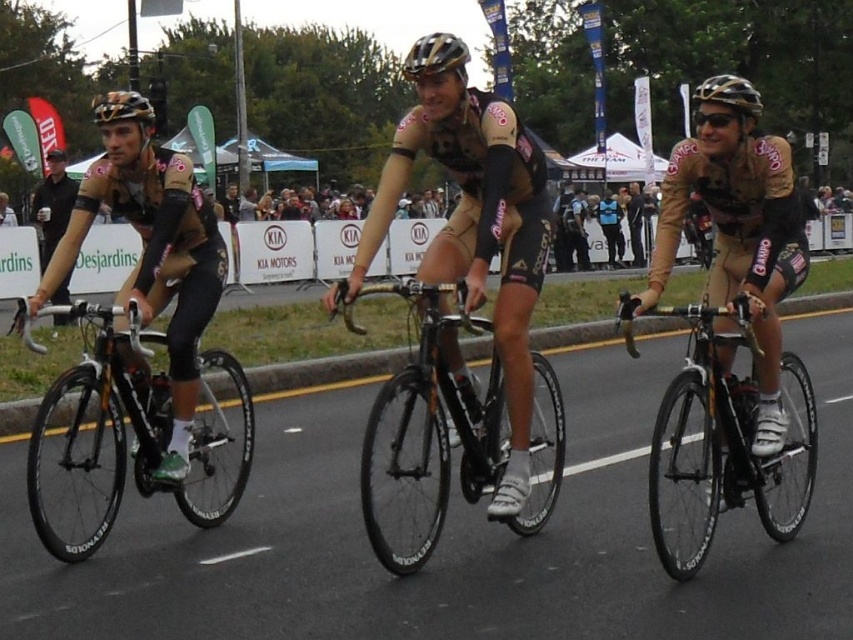
Question: In this image, where is shiny black frame at left located relative to gold metallic helmet at upper left?

Choices:
 (A) right
 (B) left

Answer: (A)

Question: Which point is farther from the camera taking this photo?

Choices:
 (A) (123, 96)
 (B) (438, 477)

Answer: (B)

Question: Can you confirm if matte black helmet at left is smaller than gold metallic bicycle helmet at center?

Choices:
 (A) no
 (B) yes

Answer: (A)

Question: Which point is closer to the camera taking this photo?

Choices:
 (A) (733, 81)
 (B) (537, 410)
 (C) (724, 141)
 (D) (138, 97)

Answer: (A)

Question: Observing the image, what is the correct spatial positioning of shiny black frame at left in reference to gold metallic helmet at center?

Choices:
 (A) above
 (B) below

Answer: (B)

Question: Which point is farther to the camera?

Choices:
 (A) (212, 456)
 (B) (466, 48)

Answer: (A)